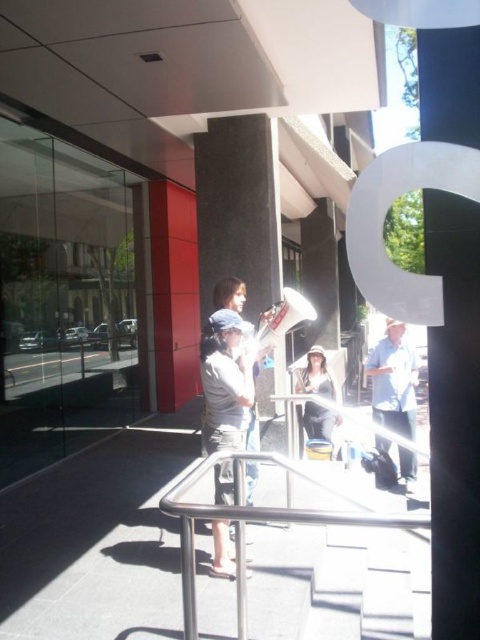
You are standing at the railing on the balcony and want to point out two specific points in the scene. The first point is at coordinates point (412, 492) and the second is at point (308, 436). From your vantage point, which point is closer to you?

Point (412, 492) is in front of point (308, 436), so it is closer to you.

Looking at this image, you are an architect designing a balcony with the satin silver railing at center and a matte black hat at center placed nearby. Which object would require more space in the design plans?

The satin silver railing at center has a larger size compared to the matte black hat at center, so it would require more space in the design plans.